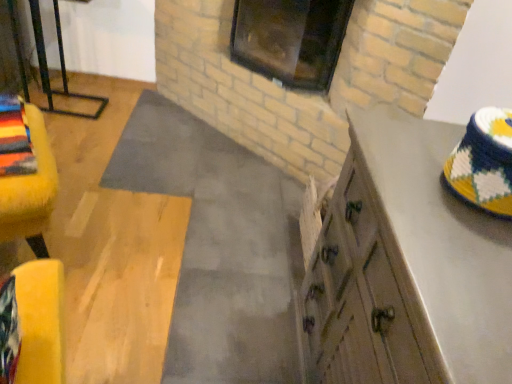
Question: From the image's perspective, would you say wooden cabinet at right is shown under yellow fuzzy ottoman at left?

Choices:
 (A) no
 (B) yes

Answer: (B)

Question: Does wooden cabinet at right come behind yellow fuzzy ottoman at left?

Choices:
 (A) no
 (B) yes

Answer: (A)

Question: Is wooden cabinet at right in contact with yellow fuzzy ottoman at left?

Choices:
 (A) no
 (B) yes

Answer: (A)

Question: Considering the relative sizes of wooden cabinet at right and yellow fuzzy ottoman at left in the image provided, is wooden cabinet at right taller than yellow fuzzy ottoman at left?

Choices:
 (A) yes
 (B) no

Answer: (A)

Question: Is wooden cabinet at right completely or partially outside of yellow fuzzy ottoman at left?

Choices:
 (A) yes
 (B) no

Answer: (A)

Question: Is wooden cabinet at right thinner than yellow fuzzy ottoman at left?

Choices:
 (A) yes
 (B) no

Answer: (B)

Question: Can you confirm if dark glass window at upper center is shorter than wooden cabinet at right?

Choices:
 (A) yes
 (B) no

Answer: (A)

Question: Does dark glass window at upper center have a smaller size compared to wooden cabinet at right?

Choices:
 (A) yes
 (B) no

Answer: (A)

Question: Is dark glass window at upper center positioned in front of wooden cabinet at right?

Choices:
 (A) no
 (B) yes

Answer: (A)

Question: Is dark glass window at upper center aimed at wooden cabinet at right?

Choices:
 (A) yes
 (B) no

Answer: (B)

Question: From a real-world perspective, is dark glass window at upper center under wooden cabinet at right?

Choices:
 (A) yes
 (B) no

Answer: (B)

Question: Does dark glass window at upper center have a larger size compared to wooden cabinet at right?

Choices:
 (A) yes
 (B) no

Answer: (B)

Question: Can we say dark glass window at upper center lies outside yellow fuzzy ottoman at left?

Choices:
 (A) no
 (B) yes

Answer: (B)